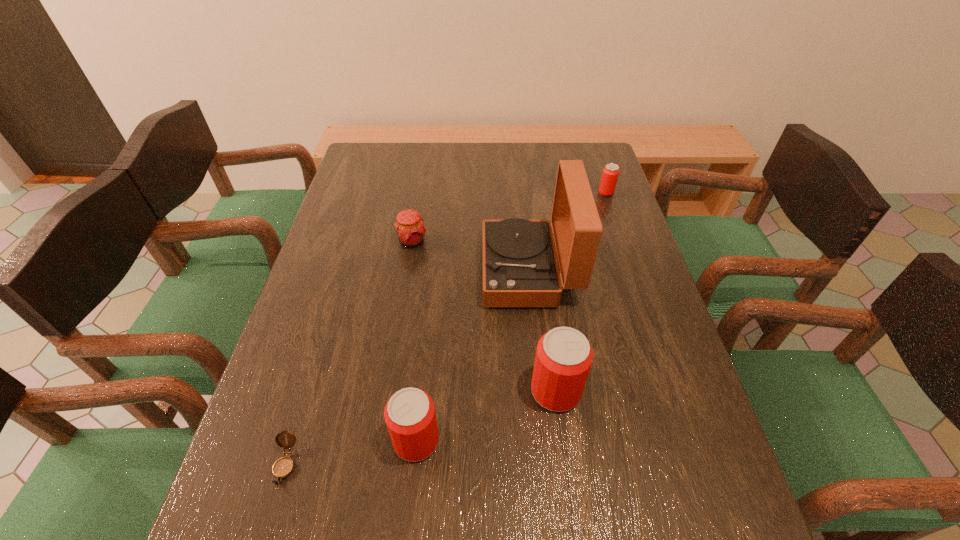
Where is `object positioned at the near left corner`? This screenshot has height=540, width=960. object positioned at the near left corner is located at coordinates (283, 467).

Find the location of a particular element. The image size is (960, 540). free space at the far edge is located at coordinates (513, 146).

In the image, there is a desktop. At what (x,y) coordinates should I click in order to perform the action: click on vacant space at the near edge. Please return your answer as a coordinate pair (x, y). Image resolution: width=960 pixels, height=540 pixels. Looking at the image, I should click on (541, 458).

Locate an element on the screen. vacant space at the left edge of the desktop is located at coordinates (372, 272).

You are a GUI agent. You are given a task and a screenshot of the screen. Output one action in this format:
    pyautogui.click(x=<x>, y=<y>)
    Task: Click on the vacant area at the right edge of the desktop
    The height and width of the screenshot is (540, 960).
    Given the screenshot: What is the action you would take?
    pyautogui.click(x=712, y=444)

Locate an element on the screen. vacant space at the far left corner of the desktop is located at coordinates (403, 146).

Where is `vacant region at the near right corner of the desktop`? The width and height of the screenshot is (960, 540). vacant region at the near right corner of the desktop is located at coordinates (661, 456).

The height and width of the screenshot is (540, 960). Find the location of `free space that is in between the shortest object and the leftmost beer can`. free space that is in between the shortest object and the leftmost beer can is located at coordinates (351, 453).

Find the location of a particular element. vacant space in between the leftmost beer can and the jam is located at coordinates (414, 341).

What are the coordinates of `free space between the jam and the second beer can from left to right` in the screenshot? It's located at (484, 316).